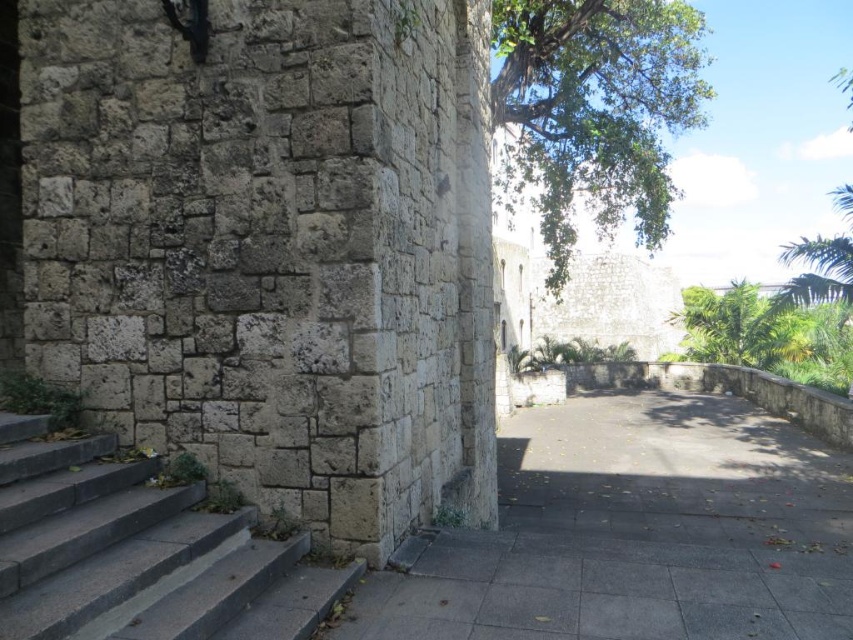
Consider the image. You are standing in front of the historic stone wall and notice two points marked on the wall. The first point is at coordinates point (50,593) and the second is at point (561,228). Which point is closer to you?

Point (50,593) is closer to the camera than point (561,228).

You are standing at the base of the historic stone wall and notice a specific point marked at coordinates [634,532]. Based on the scene description, where would this point most likely be located?

The point [634,532] is on gray concrete pavement at lower center, so it is located on the gray concrete steps leading up to the wall at the lower part of the image.

You are standing on the gray concrete pavement at lower center and want to look up at the green leafy tree at upper center. Which object is taller?

The green leafy tree at upper center is taller than the gray concrete pavement at lower center.